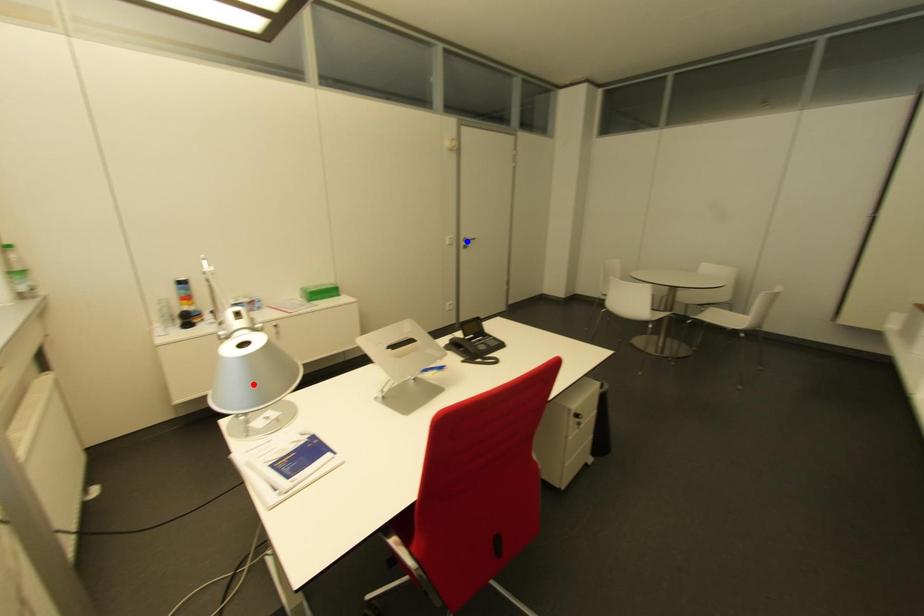
Question: In the image, two points are highlighted. Which point is nearer to the camera? Reply with the corresponding letter.

Choices:
 (A) blue point
 (B) red point

Answer: (B)